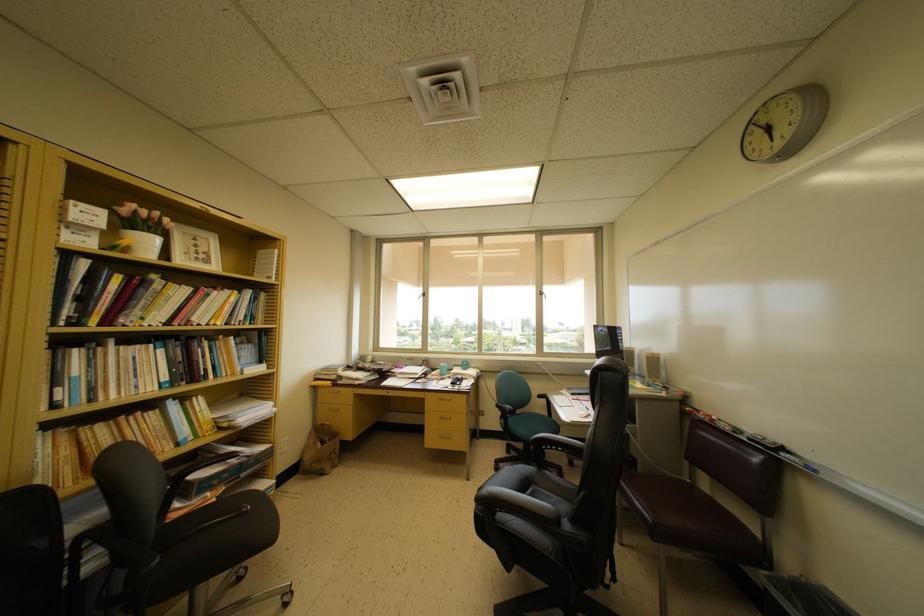
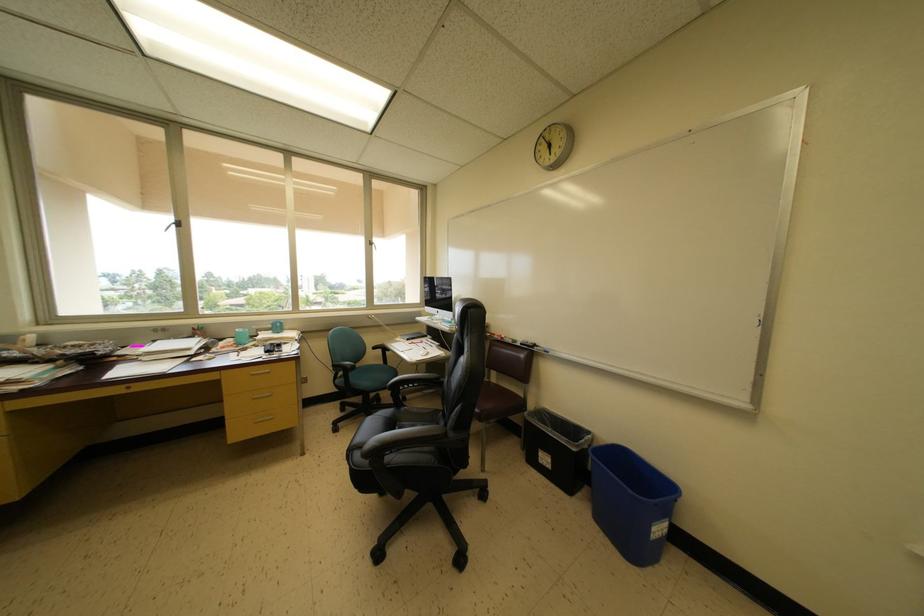
Find the pixel in the second image that matches point (445, 369) in the first image.

(240, 334)